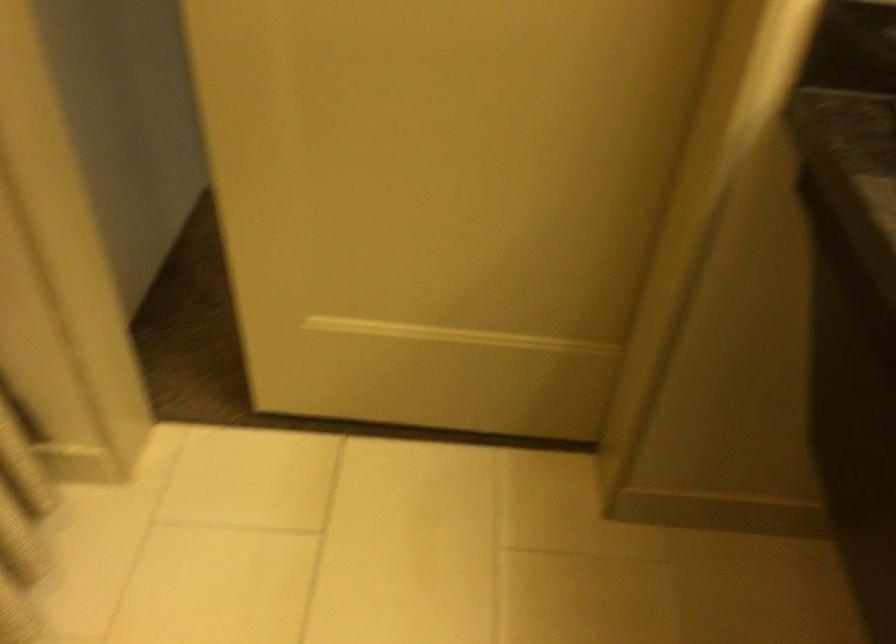
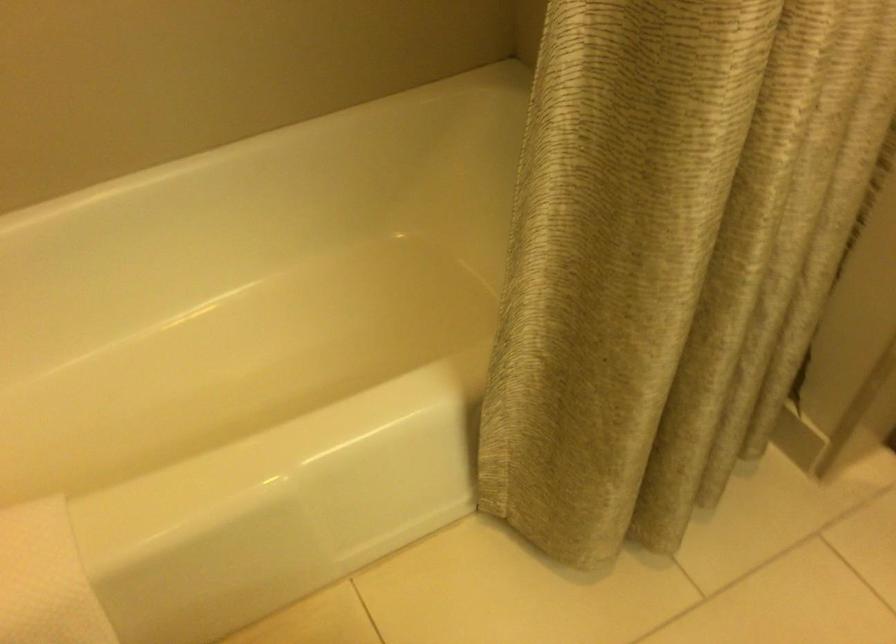
The images are taken continuously from a first-person perspective. In which direction is your viewpoint rotating?

The camera rotated toward left-down.